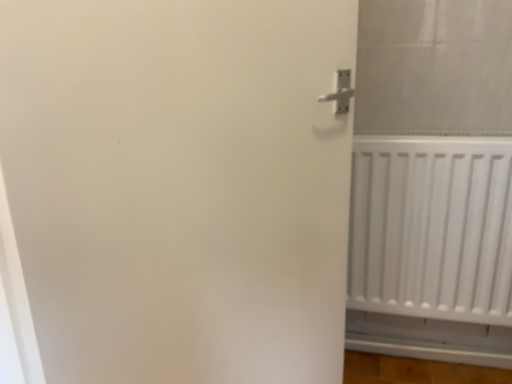
Question: Are white matte door at right and white matte radiator at right located far from each other?

Choices:
 (A) yes
 (B) no

Answer: (B)

Question: From a real-world perspective, is white matte door at right positioned under white matte radiator at right based on gravity?

Choices:
 (A) yes
 (B) no

Answer: (B)

Question: From the image's perspective, would you say white matte door at right is positioned over white matte radiator at right?

Choices:
 (A) yes
 (B) no

Answer: (B)

Question: Considering the relative sizes of white matte door at right and white matte radiator at right in the image provided, is white matte door at right thinner than white matte radiator at right?

Choices:
 (A) no
 (B) yes

Answer: (B)

Question: Considering the relative positions of white matte door at right and white matte radiator at right in the image provided, is white matte door at right to the right of white matte radiator at right from the viewer's perspective?

Choices:
 (A) no
 (B) yes

Answer: (A)

Question: Does white matte door at right contain white matte radiator at right?

Choices:
 (A) yes
 (B) no

Answer: (B)

Question: Can you confirm if white matte radiator at right is taller than white matte door at right?

Choices:
 (A) no
 (B) yes

Answer: (A)

Question: Is white matte radiator at right further to the viewer compared to white matte door at right?

Choices:
 (A) yes
 (B) no

Answer: (A)

Question: From a real-world perspective, is white matte radiator at right beneath white matte door at right?

Choices:
 (A) no
 (B) yes

Answer: (B)

Question: Is white matte radiator at right next to white matte door at right and touching it?

Choices:
 (A) no
 (B) yes

Answer: (A)

Question: Does white matte radiator at right appear on the right side of white matte door at right?

Choices:
 (A) yes
 (B) no

Answer: (A)

Question: From a real-world perspective, is white matte radiator at right on top of white matte door at right?

Choices:
 (A) no
 (B) yes

Answer: (A)

Question: Looking at their shapes, would you say white matte radiator at right is wider or thinner than white matte door at right?

Choices:
 (A) wide
 (B) thin

Answer: (A)